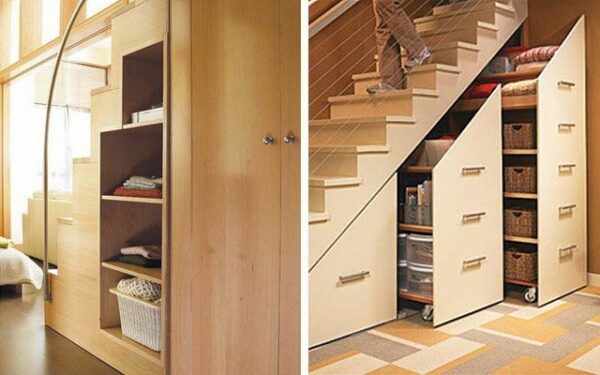
This screenshot has height=375, width=600. I want to click on carpet, so click(503, 352).